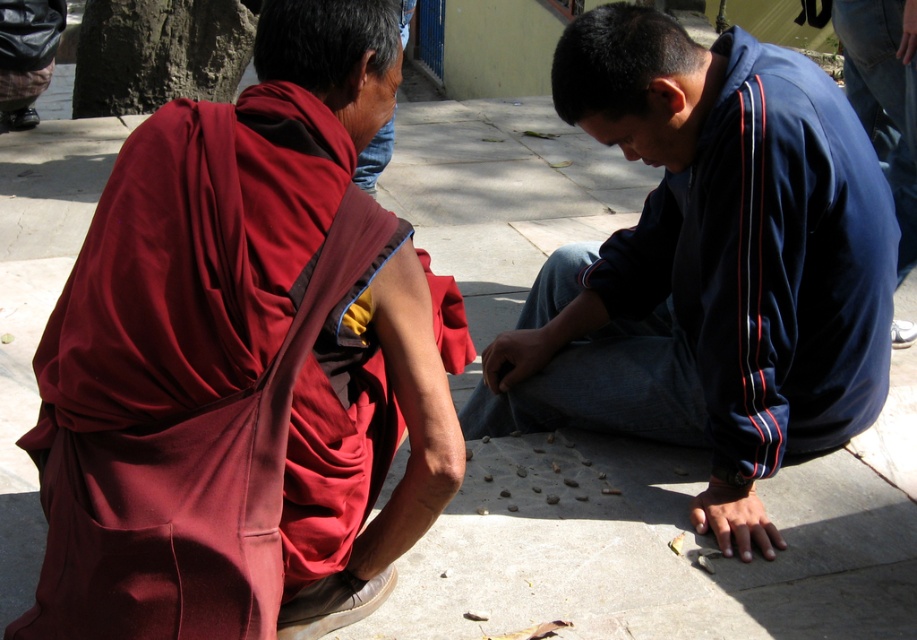
Question: Is maroon silk robe at left above dark blue velour jacket at center?

Choices:
 (A) no
 (B) yes

Answer: (A)

Question: Is maroon silk robe at left to the left of dark blue velour jacket at center from the viewer's perspective?

Choices:
 (A) yes
 (B) no

Answer: (A)

Question: Does maroon silk robe at left appear on the right side of dark blue velour jacket at center?

Choices:
 (A) yes
 (B) no

Answer: (B)

Question: Among these points, which one is farthest from the camera?

Choices:
 (A) (250, 173)
 (B) (732, 164)

Answer: (B)

Question: Among these points, which one is farthest from the camera?

Choices:
 (A) (260, 433)
 (B) (632, 60)

Answer: (B)